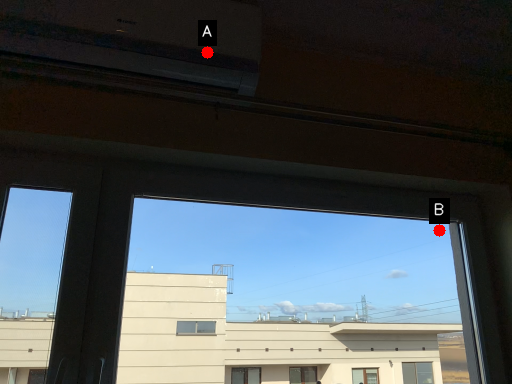
Question: Two points are circled on the image, labeled by A and B beside each circle. Which point appears closest to the camera in this image?

Choices:
 (A) A is closer
 (B) B is closer

Answer: (A)